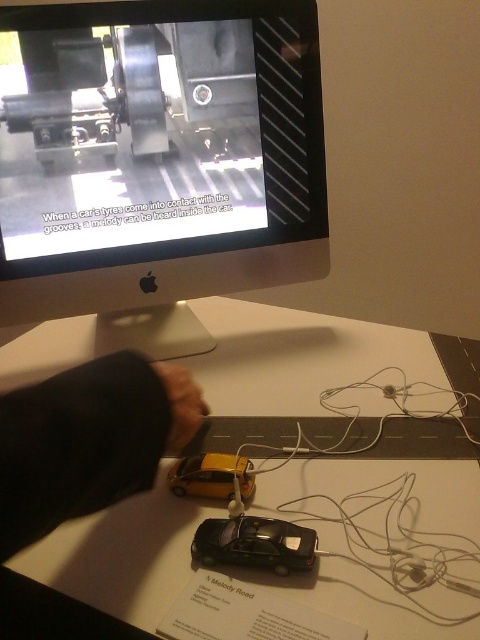
You are standing in front of the exhibit and want to touch the point at coordinate (338,561). The exhibit requires that you can only interact with objects within 20 inches of your position. Can you safely reach this point without moving closer?

The point at coordinate (338,561) is 20.49 inches away from the viewer. Since this distance is slightly more than 20 inches, you cannot safely reach it without moving closer.

You are a visitor at the exhibit and want to touch the satin silver monitor at upper center and the yellow matte car at center. Which object will you need to reach further to touch?

You will need to reach further to touch the yellow matte car at center because the satin silver monitor at upper center is closer to you, while the yellow matte car at center is farther away.

You are standing in front of the display setup and want to locate the monitor. According to the coordinates provided, where exactly is the satin silver monitor at upper center positioned?

The satin silver monitor at upper center is positioned at coordinates point (156, 150).